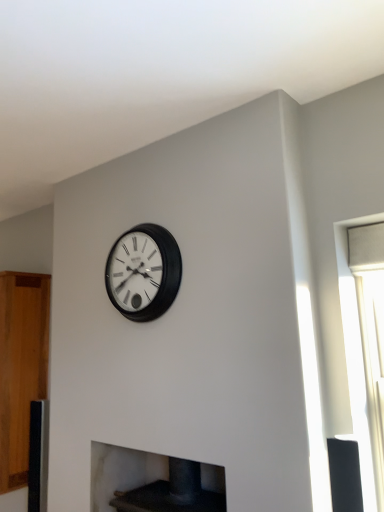
Question: From a real-world perspective, relative to matte black clock at center, is wooden cabinet at left vertically above or below?

Choices:
 (A) above
 (B) below

Answer: (B)

Question: In terms of size, does wooden cabinet at left appear bigger or smaller than matte black clock at center?

Choices:
 (A) small
 (B) big

Answer: (B)

Question: Considering the real-world distances, which object is closest to the dark gray stone fireplace at lower center?

Choices:
 (A) wooden cabinet at left
 (B) matte black clock at center

Answer: (A)

Question: Which is farther from the dark gray stone fireplace at lower center?

Choices:
 (A) wooden cabinet at left
 (B) matte black clock at center

Answer: (B)